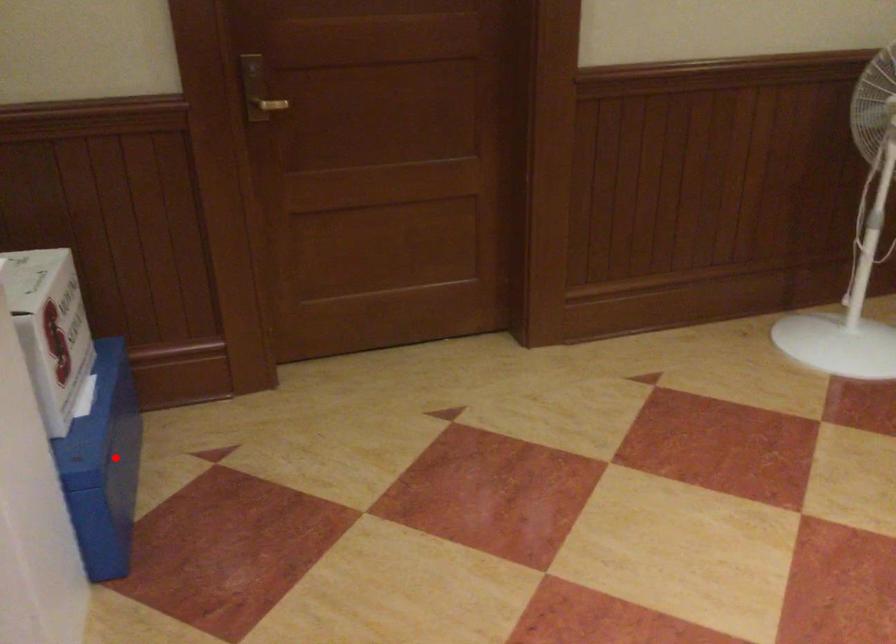
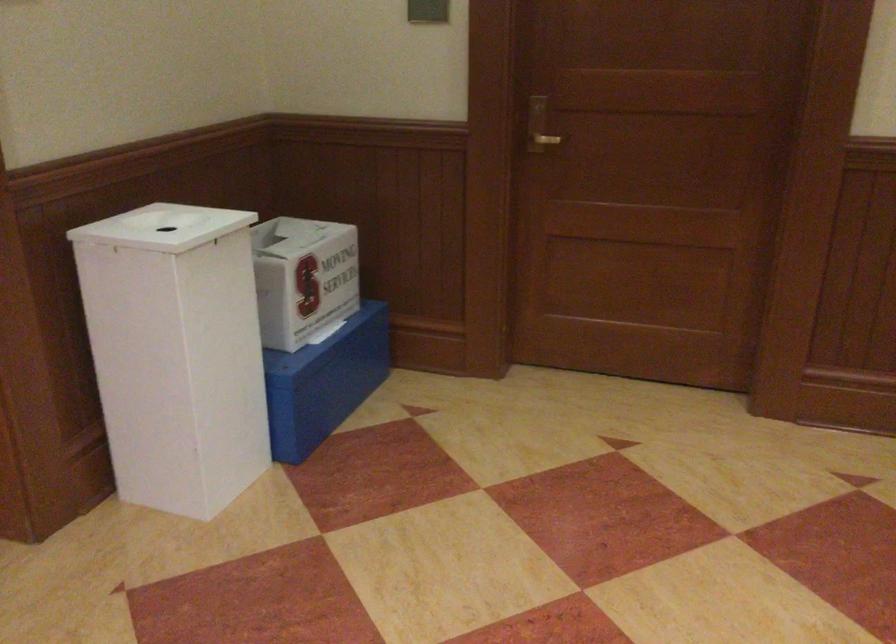
In the second image, find the point that corresponds to the highlighted location in the first image.

(323, 382)